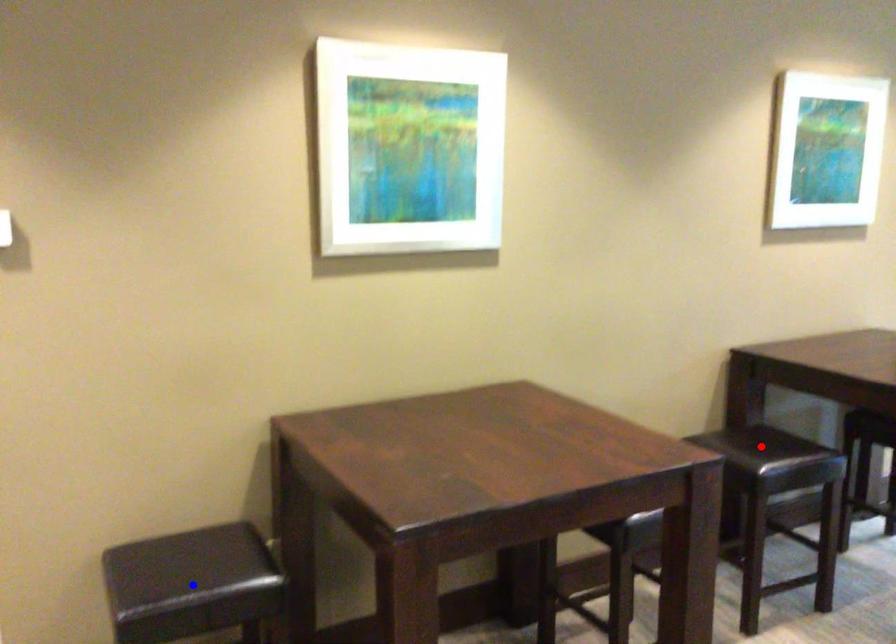
Question: In the image, two points are highlighted. Which point is nearer to the camera? Reply with the corresponding letter.

Choices:
 (A) blue point
 (B) red point

Answer: (A)